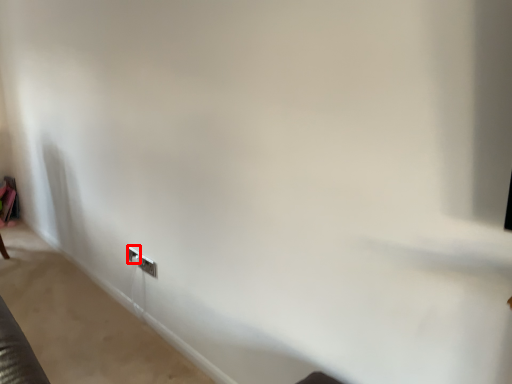
Question: From the image, what is the correct spatial relationship of electric outlet (annotated by the red box) in relation to electric outlet?

Choices:
 (A) left
 (B) right

Answer: (A)